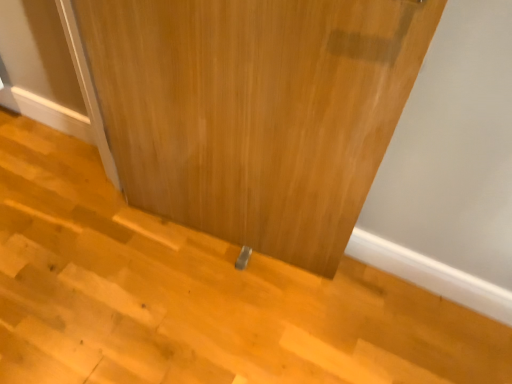
Question: Should I look upward or downward to see wooden at lower center?

Choices:
 (A) down
 (B) up

Answer: (A)

Question: Does wooden door at center have a lesser width compared to wooden at lower center?

Choices:
 (A) yes
 (B) no

Answer: (A)

Question: From a real-world perspective, is wooden door at center on top of wooden at lower center?

Choices:
 (A) no
 (B) yes

Answer: (B)

Question: Is wooden door at center aimed at wooden at lower center?

Choices:
 (A) yes
 (B) no

Answer: (A)

Question: From the image's perspective, is wooden door at center beneath wooden at lower center?

Choices:
 (A) yes
 (B) no

Answer: (B)

Question: Considering the relative sizes of wooden door at center and wooden at lower center in the image provided, is wooden door at center taller than wooden at lower center?

Choices:
 (A) no
 (B) yes

Answer: (B)

Question: Is wooden door at center outside of wooden at lower center?

Choices:
 (A) no
 (B) yes

Answer: (B)

Question: From the image's perspective, is wooden at lower center on wooden door at center?

Choices:
 (A) yes
 (B) no

Answer: (B)

Question: Can you see wooden at lower center touching wooden door at center?

Choices:
 (A) no
 (B) yes

Answer: (A)

Question: Can you confirm if wooden at lower center is smaller than wooden door at center?

Choices:
 (A) yes
 (B) no

Answer: (A)

Question: Would you say wooden door at center is part of wooden at lower center's contents?

Choices:
 (A) no
 (B) yes

Answer: (A)

Question: Considering the relative sizes of wooden at lower center and wooden door at center in the image provided, is wooden at lower center thinner than wooden door at center?

Choices:
 (A) yes
 (B) no

Answer: (B)

Question: Is there a large distance between wooden at lower center and wooden door at center?

Choices:
 (A) yes
 (B) no

Answer: (B)

Question: From a real-world perspective, is wooden door at center physically located above or below wooden at lower center?

Choices:
 (A) below
 (B) above

Answer: (B)